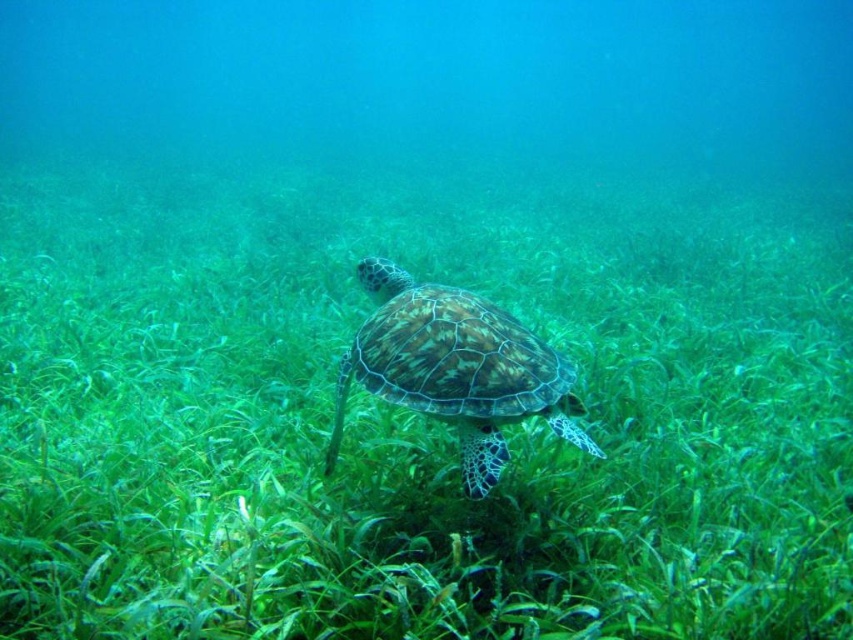
Question: Which object appears farthest from the camera in this image?

Choices:
 (A) green leafy grass at center
 (B) green textured shell at center

Answer: (B)

Question: Where is green leafy grass at center located in relation to green textured shell at center in the image?

Choices:
 (A) right
 (B) left

Answer: (A)

Question: Is green leafy grass at center to the right of green textured shell at center from the viewer's perspective?

Choices:
 (A) yes
 (B) no

Answer: (A)

Question: Can you confirm if green leafy grass at center is positioned to the left of green textured shell at center?

Choices:
 (A) no
 (B) yes

Answer: (A)

Question: Which of the following is the farthest from the observer?

Choices:
 (A) green textured shell at center
 (B) green leafy grass at center

Answer: (A)

Question: Which point appears closest to the camera in this image?

Choices:
 (A) tap(86, 291)
 (B) tap(589, 442)

Answer: (B)